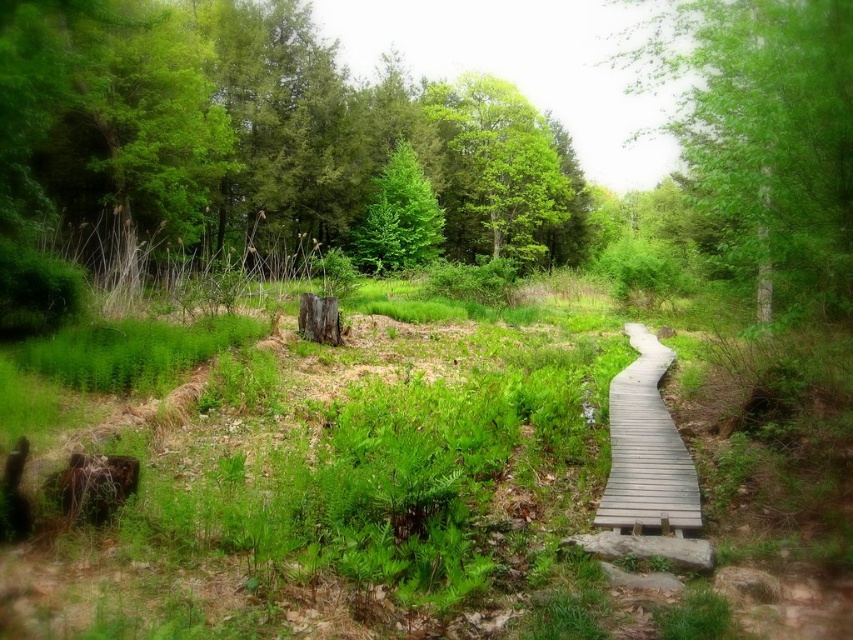
You are planning to place a small garden bench on the green grass at center and the green matte tree at center. Which location has enough space to accommodate the bench without overlapping with the other object?

The green grass at center might be wider than the green matte tree at center, so the bench can be placed on the green grass at center without overlapping with the green matte tree at center.

You are a hiker standing on the wooden boardwalk and want to take a photo of both the green leafy tree at upper center and the green matte tree at center. Which tree should you position closer to the camera to include both in the frame?

To include both the green leafy tree at upper center and the green matte tree at center in the frame, position the green leafy tree at upper center closer to the camera since it is larger and will take up more space in the photo.